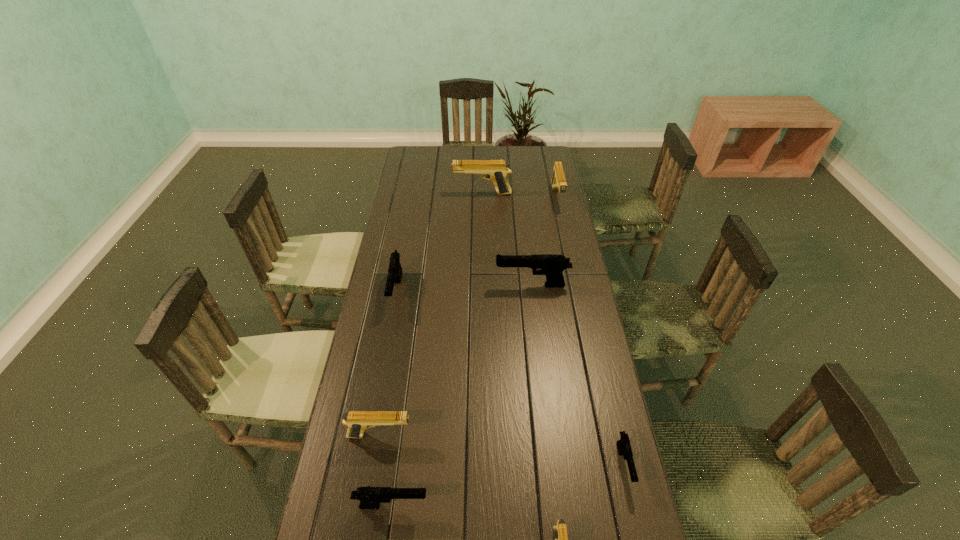
Find the location of a particular element. blank region between the third biggest black pistol and the second tan pistol from left to right is located at coordinates (437, 349).

You are a GUI agent. You are given a task and a screenshot of the screen. Output one action in this format:
    pyautogui.click(x=<x>, y=<y>)
    Task: Click on the blank region between the biggest black pistol and the rightmost tan pistol
    This screenshot has width=960, height=540.
    Given the screenshot: What is the action you would take?
    pyautogui.click(x=544, y=241)

Identify the location of unoccupied position between the biggest tan pistol and the third farthest black pistol. The width and height of the screenshot is (960, 540). (553, 329).

The width and height of the screenshot is (960, 540). I want to click on object that is the fourth closest to the seventh farthest object, so click(x=395, y=270).

This screenshot has width=960, height=540. What are the coordinates of `the fourth closest object relative to the seventh farthest pistol` in the screenshot? It's located at (395, 270).

Find the location of a particular element. pistol that stands as the sixth closest to the third biggest black pistol is located at coordinates (558, 181).

Identify which pistol is the seventh closest to the second biggest black pistol. Please provide its 2D coordinates. Your answer should be formatted as a tuple, i.e. [(x, y)], where the tuple contains the x and y coordinates of a point satisfying the conditions above.

[(560, 531)]

Locate which tan pistol is the closest to the third black pistol from left to right. Please provide its 2D coordinates. Your answer should be formatted as a tuple, i.e. [(x, y)], where the tuple contains the x and y coordinates of a point satisfying the conditions above.

[(558, 181)]

Select which tan pistol is the second closest to the biggest tan pistol. Please provide its 2D coordinates. Your answer should be formatted as a tuple, i.e. [(x, y)], where the tuple contains the x and y coordinates of a point satisfying the conditions above.

[(357, 421)]

The width and height of the screenshot is (960, 540). Find the location of `black pistol that can be found as the second closest to the fourth nearest object`. black pistol that can be found as the second closest to the fourth nearest object is located at coordinates (395, 270).